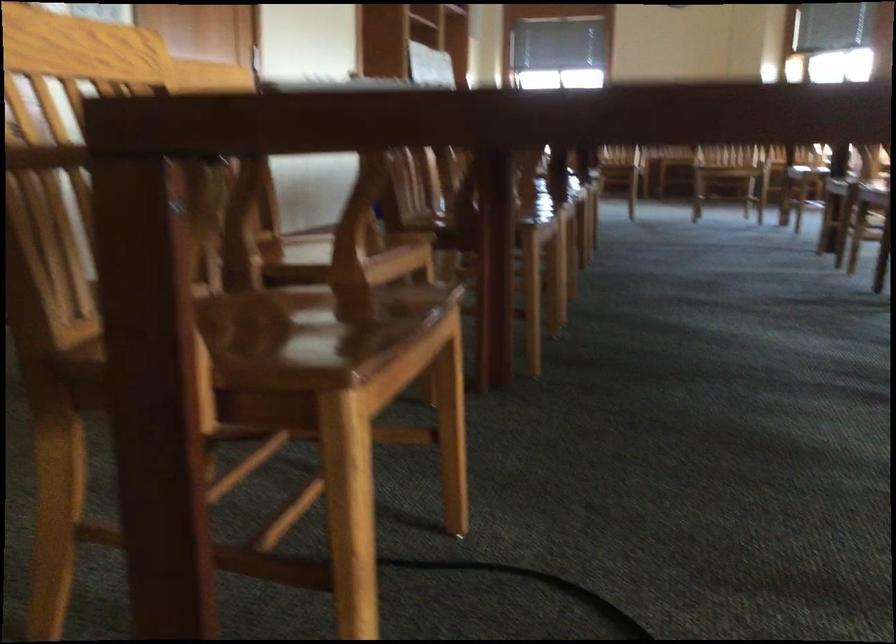
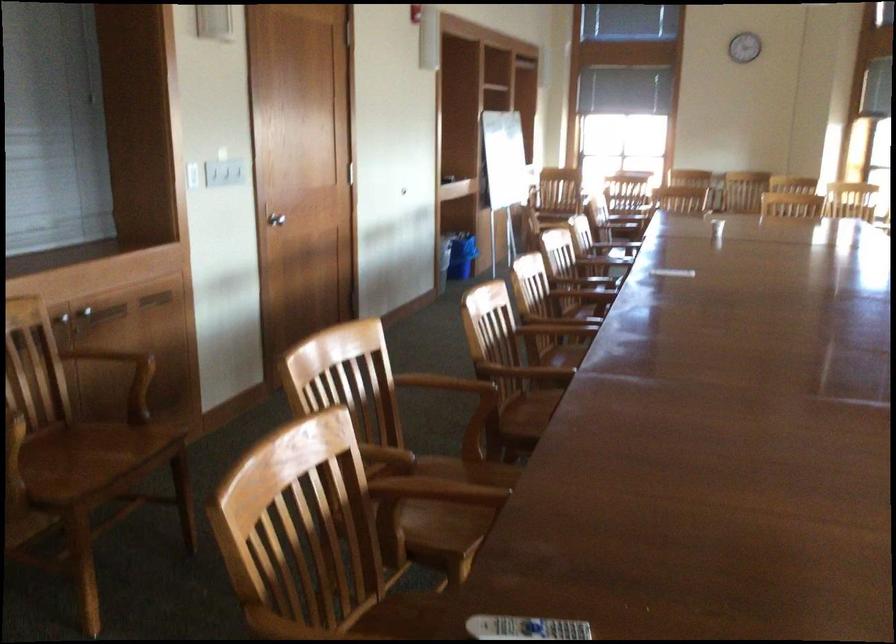
Find the pixel in the second image that matches point 337,86 in the first image.

(524, 628)